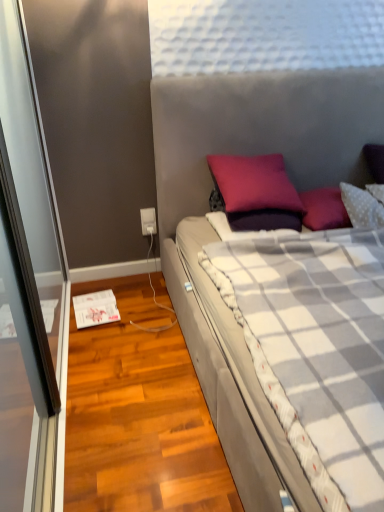
This screenshot has width=384, height=512. What are the coordinates of `purple matte pillow at center` in the screenshot? It's located at (254, 183).

Which of these two, white plastic power outlet at lower left or plush gray bed at center, is wider?

With larger width is plush gray bed at center.

Is point (147, 229) positioned after point (217, 428)?

Yes, it is behind point (217, 428).

Looking at this image, do you think white plastic power outlet at lower left is within plush gray bed at center, or outside of it?

white plastic power outlet at lower left is not inside plush gray bed at center, it's outside.

Is white plastic power outlet at lower left positioned far away from plush gray bed at center?

Actually, white plastic power outlet at lower left and plush gray bed at center are a little close together.

Which object is thinner, plush gray bed at center or white plastic power outlet at lower left?

Thinner between the two is white plastic power outlet at lower left.

Would you say plush gray bed at center is a long distance from white plastic power outlet at lower left?

No, there isn't a large distance between plush gray bed at center and white plastic power outlet at lower left.

From a real-world perspective, between plush gray bed at center and white plastic power outlet at lower left, who is vertically higher?

plush gray bed at center is physically above.

This screenshot has width=384, height=512. Identify the location of power outlet lying above the plush gray bed at center (from the image's perspective). (148, 221).

Is purple matte pillow at center in front of or behind white plastic power outlet at lower left in the image?

Clearly, purple matte pillow at center is in front of white plastic power outlet at lower left.

Is purple matte pillow at center far from white plastic power outlet at lower left?

Actually, purple matte pillow at center and white plastic power outlet at lower left are a little close together.

Considering the sizes of objects purple matte pillow at center and white plastic power outlet at lower left in the image provided, who is shorter, purple matte pillow at center or white plastic power outlet at lower left?

With less height is white plastic power outlet at lower left.

Does point (269, 183) appear closer or farther from the camera than point (149, 213)?

Point (269, 183) is closer to the camera than point (149, 213).

Looking at this image, is white plastic power outlet at lower left to the left of purple matte pillow at center from the viewer's perspective?

Yes, white plastic power outlet at lower left is to the left of purple matte pillow at center.

Which of these two, white plastic power outlet at lower left or purple matte pillow at center, is thinner?

white plastic power outlet at lower left is thinner.

Does point (147, 231) come farther from viewer compared to point (225, 199)?

Yes, point (147, 231) is farther from viewer.

Which of these two, white plastic power outlet at lower left or purple matte pillow at center, stands taller?

purple matte pillow at center.

Which object is positioned more to the left, purple matte pillow at center or plush gray bed at center?

purple matte pillow at center is more to the left.

In the scene shown: Is purple matte pillow at center aimed at plush gray bed at center?

Yes, purple matte pillow at center faces towards plush gray bed at center.

Is purple matte pillow at center located outside plush gray bed at center?

No, purple matte pillow at center is inside plush gray bed at center's boundary.

What are the coordinates of `bed on the right of the purple matte pillow at center` in the screenshot? It's located at point(217,236).

From the image's perspective, would you say plush gray bed at center is shown under purple matte pillow at center?

Indeed, from the image's perspective, plush gray bed at center is shown beneath purple matte pillow at center.

Find the location of a particular element. The width and height of the screenshot is (384, 512). bed in front of the purple matte pillow at center is located at coordinates (217, 236).

Is plush gray bed at center touching purple matte pillow at center?

They are not placed beside each other.

Can we say plush gray bed at center lies outside purple matte pillow at center?

Indeed, plush gray bed at center is completely outside purple matte pillow at center.

Where is `bed above the white plastic power outlet at lower left (from a real-world perspective)`? The height and width of the screenshot is (512, 384). bed above the white plastic power outlet at lower left (from a real-world perspective) is located at coordinates (217, 236).

The height and width of the screenshot is (512, 384). Find the location of `bed that appears below the white plastic power outlet at lower left (from the image's perspective)`. bed that appears below the white plastic power outlet at lower left (from the image's perspective) is located at coordinates (217, 236).

Which object lies further to the anchor point white plastic power outlet at lower left, purple matte pillow at center or plush gray bed at center?

plush gray bed at center is positioned further to the anchor white plastic power outlet at lower left.

When comparing their distances from white plastic power outlet at lower left, does plush gray bed at center or purple matte pillow at center seem closer?

purple matte pillow at center lies closer to white plastic power outlet at lower left than the other object.

Based on their spatial positions, is purple matte pillow at center or white plastic power outlet at lower left closer to plush gray bed at center?

purple matte pillow at center.

When comparing their distances from plush gray bed at center, does white plastic power outlet at lower left or purple matte pillow at center seem further?

white plastic power outlet at lower left is further to plush gray bed at center.

Estimate the real-world distances between objects in this image. Which object is further from purple matte pillow at center, white plastic power outlet at lower left or plush gray bed at center?

white plastic power outlet at lower left is further to purple matte pillow at center.

Based on their spatial positions, is plush gray bed at center or white plastic power outlet at lower left closer to purple matte pillow at center?

The object closer to purple matte pillow at center is plush gray bed at center.

Locate an element on the screen. The image size is (384, 512). pillow between plush gray bed at center and white plastic power outlet at lower left from front to back is located at coordinates (254, 183).